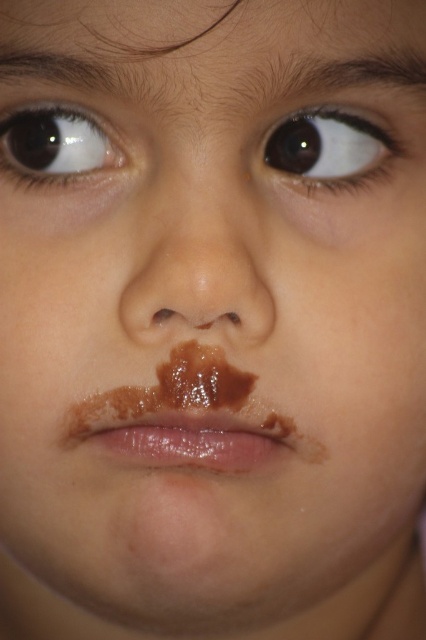
Question: Is shiny brown nose at center bigger than brown glossy eye at upper center?

Choices:
 (A) yes
 (B) no

Answer: (A)

Question: Which of the following is the farthest from the observer?

Choices:
 (A) (149, 282)
 (B) (134, 451)
 (C) (388, 148)
 (D) (104, 141)

Answer: (C)

Question: Does shiny brown nose at center lie in front of brown glossy eye at upper center?

Choices:
 (A) yes
 (B) no

Answer: (A)

Question: Among these objects, which one is nearest to the camera?

Choices:
 (A) brown glossy eye at upper left
 (B) brown glossy eye at upper center

Answer: (A)

Question: Which object is closer to the camera taking this photo?

Choices:
 (A) shiny brown lips at center
 (B) shiny brown nose at center
 (C) brown glossy eye at upper center
 (D) brown glossy eye at upper left

Answer: (B)

Question: Is shiny brown nose at center smaller than brown glossy eye at upper center?

Choices:
 (A) no
 (B) yes

Answer: (A)